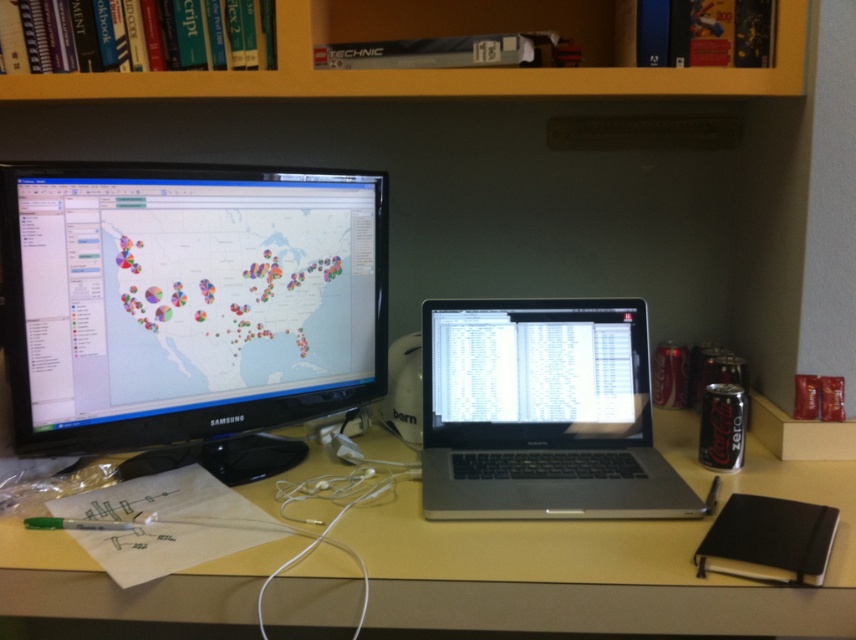
Question: Which of the following is the closest to the observer?

Choices:
 (A) black glossy monitor at left
 (B) yellow matte table at center
 (C) yellow wood bookshelf at upper center
 (D) sleek silver laptop at center

Answer: (B)

Question: Estimate the real-world distances between objects in this image. Which object is farther from the yellow wood bookshelf at upper center?

Choices:
 (A) sleek silver laptop at center
 (B) black glossy monitor at left

Answer: (A)

Question: Is black glossy monitor at left positioned at the back of yellow matte table at center?

Choices:
 (A) yes
 (B) no

Answer: (A)

Question: Can you confirm if yellow matte table at center is positioned to the left of yellow wood bookshelf at upper center?

Choices:
 (A) yes
 (B) no

Answer: (B)

Question: Where is yellow matte table at center located in relation to yellow wood bookshelf at upper center in the image?

Choices:
 (A) below
 (B) above

Answer: (A)

Question: Which point is closer to the camera taking this photo?

Choices:
 (A) (308, 285)
 (B) (610, 396)

Answer: (A)